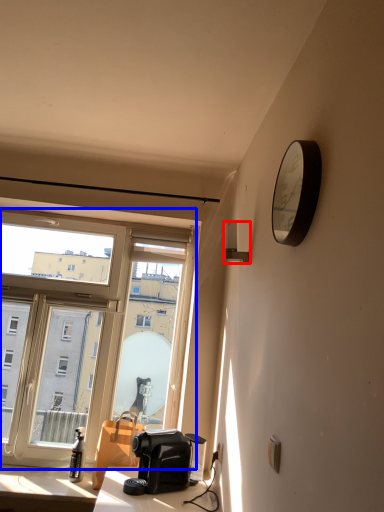
Question: Which point is further to the camera, lamp (highlighted by a red box) or window (highlighted by a blue box)?

Choices:
 (A) lamp
 (B) window

Answer: (B)